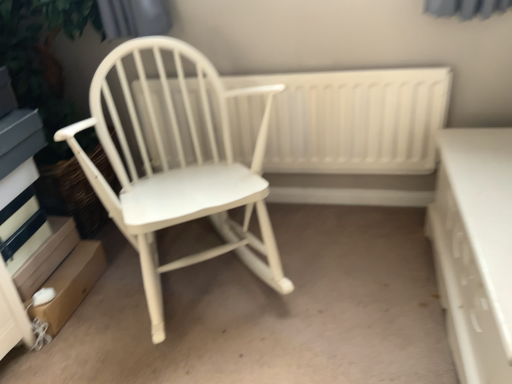
Question: From a real-world perspective, is white wood rocking chair at left positioned above or below white glossy drawer at right?

Choices:
 (A) above
 (B) below

Answer: (A)

Question: Visually, is white wood rocking chair at left positioned to the left or to the right of white glossy drawer at right?

Choices:
 (A) right
 (B) left

Answer: (B)

Question: Which is farther from the white glossy drawer at right?

Choices:
 (A) white wood rocking chair at left
 (B) white wood radiator at center

Answer: (A)

Question: Estimate the real-world distances between objects in this image. Which object is closer to the white wood radiator at center?

Choices:
 (A) white wood rocking chair at left
 (B) white glossy drawer at right

Answer: (A)